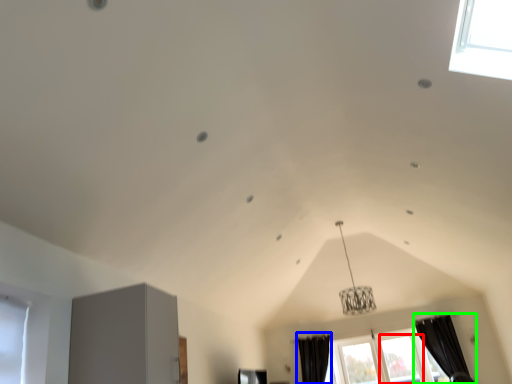
Question: Which object is the closest to the window (highlighted by a red box)? Choose among these: curtain (highlighted by a blue box) or curtain (highlighted by a green box).

Choices:
 (A) curtain
 (B) curtain

Answer: (B)